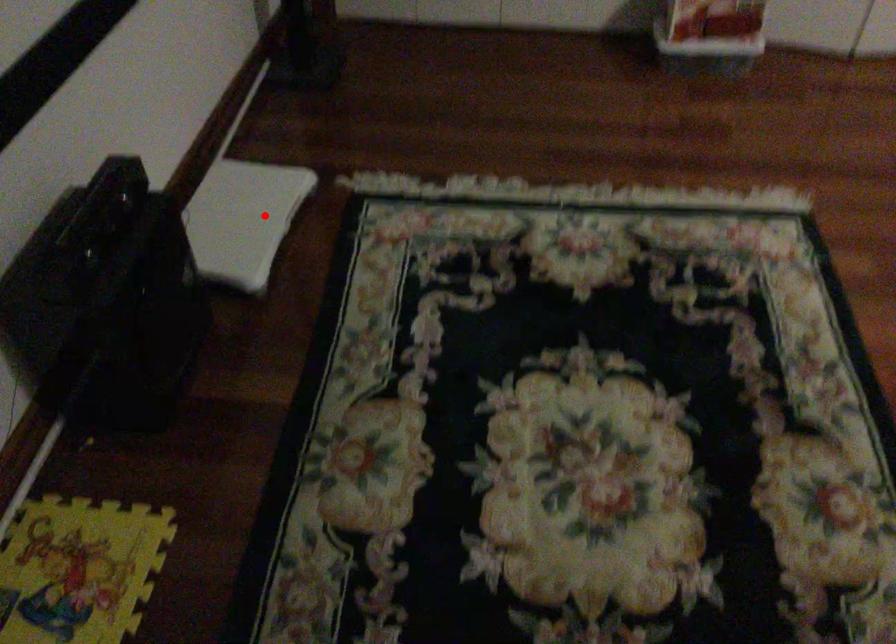
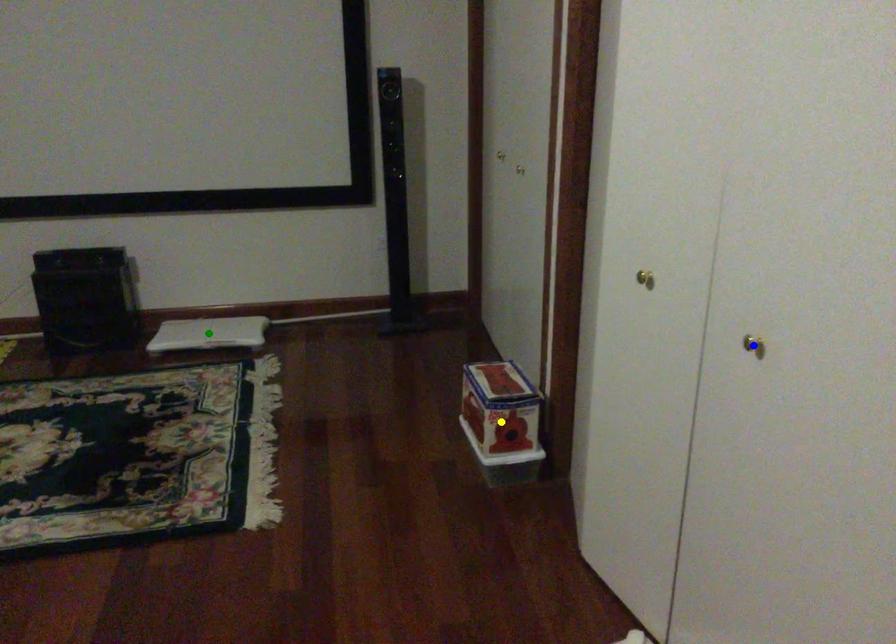
Question: I am providing you with two images of the same scene from different viewpoints. A red point is marked on the first image. You are given multiple points on the second image. Which point in image 2 represents the same 3d spot as the red point in image 1?

Choices:
 (A) green point
 (B) yellow point
 (C) blue point

Answer: (A)